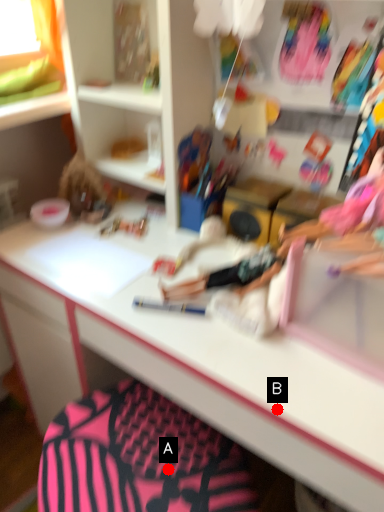
Question: Two points are circled on the image, labeled by A and B beside each circle. Which point appears closest to the camera in this image?

Choices:
 (A) A is closer
 (B) B is closer

Answer: (B)